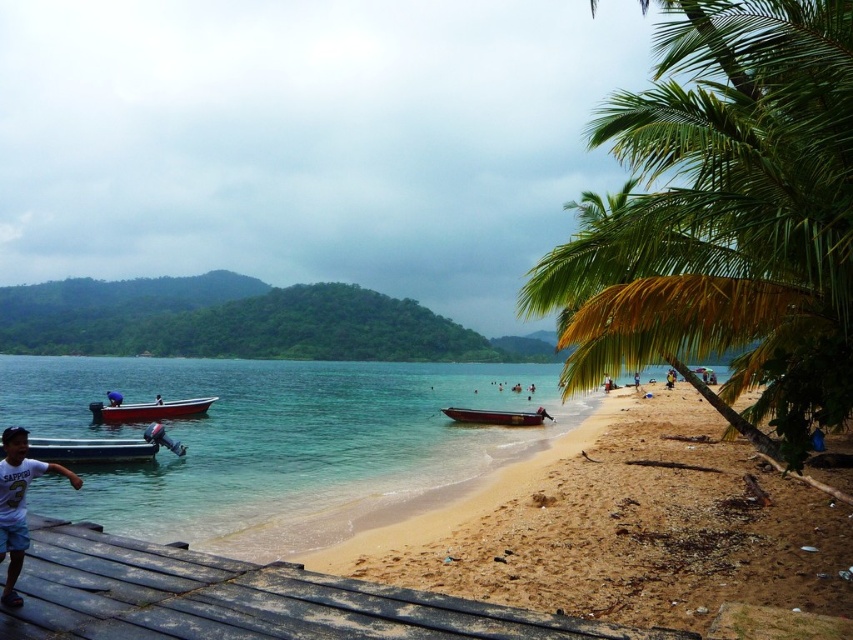
Between white cotton shirt at lower left and white plastic boat at left, which one has less height?

With less height is white cotton shirt at lower left.

Who is more distant from viewer, (9,506) or (97,403)?

Positioned behind is point (97,403).

At what (x,y) coordinates should I click in order to perform the action: click on white cotton shirt at lower left. Please return your answer as a coordinate pair (x, y). The image size is (853, 640). Looking at the image, I should click on (18, 502).

Is white plastic boat at left to the right of blue fabric person at lower left from the viewer's perspective?

Correct, you'll find white plastic boat at left to the right of blue fabric person at lower left.

Can you confirm if white plastic boat at left is positioned above blue fabric person at lower left?

Incorrect, white plastic boat at left is not positioned above blue fabric person at lower left.

Where is `white plastic boat at left`? The height and width of the screenshot is (640, 853). white plastic boat at left is located at coordinates (149, 410).

Locate an element on the screen. The width and height of the screenshot is (853, 640). white plastic boat at left is located at coordinates (149, 410).

Can you confirm if green leafy palm tree at right is bigger than white plastic boat at left?

Yes, green leafy palm tree at right is bigger than white plastic boat at left.

Who is shorter, green leafy palm tree at right or white plastic boat at left?

white plastic boat at left

Which is behind, point (613, 262) or point (113, 422)?

The point (113, 422) is behind.

Where is `green leafy palm tree at right`? This screenshot has width=853, height=640. green leafy palm tree at right is located at coordinates (724, 218).